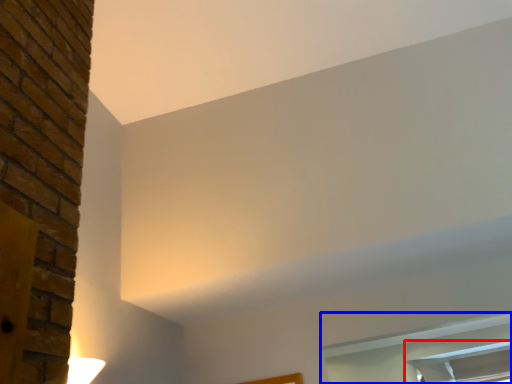
Question: Which object is further to the camera taking this photo, window (highlighted by a red box) or window (highlighted by a blue box)?

Choices:
 (A) window
 (B) window

Answer: (A)